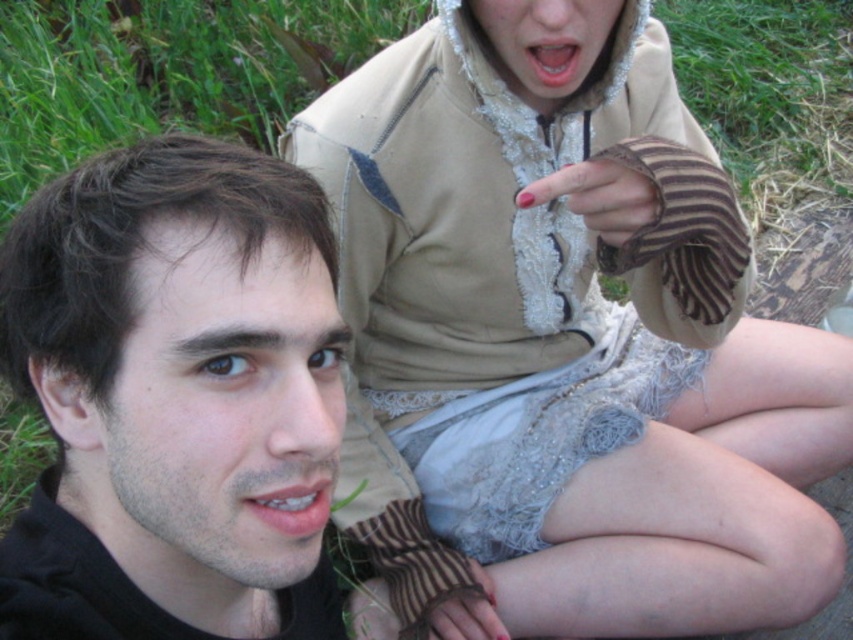
You are a photographer standing 24 inches away from the smooth black face at center. You want to take a closeup photo of it. Can you move closer to get a better shot without exceeding the minimum safe distance of 18 inches?

The smooth black face at center and viewer are 20.95 inches apart from each other. Since you are currently 24 inches away, you can move closer by 3.05 inches to reach the minimum safe distance of 18 inches. However, moving closer than 18 inches would be unsafe, so you can move closer but must stay at least 18 inches away.

You are standing in front of the two people in the image. The first person is pointing at a point marked as point 1 at coordinates point (440, 440), and the second person is pointing at a point marked as point 2 at coordinates point (241, 422). Which point is closer to you?

Point (440, 440) is closer to you because it is further to the viewer than point (241, 422).

You are a photographer trying to capture a closeup of the smooth black face at center and the nail polish at center in the image. Since you want to focus on both, which object should you adjust your camera to prioritize focusing on due to its size?

The smooth black face at center has a larger size compared to nail polish at center, so you should prioritize focusing on the smooth black face at center to ensure both are in focus.